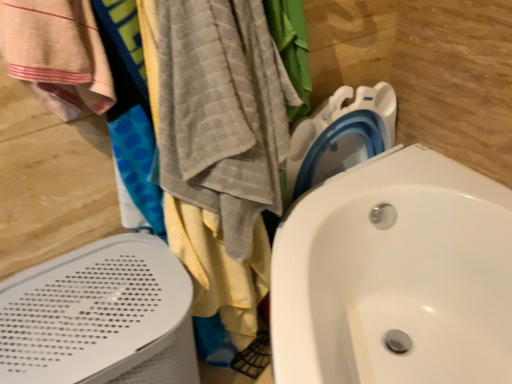
Question: Is white glossy sink at center facing towards gray textured towel at left, acting as the 2th beach towel starting from the left?

Choices:
 (A) no
 (B) yes

Answer: (A)

Question: From a real-world perspective, is white glossy sink at center positioned under gray textured towel at left, acting as the 2th beach towel starting from the left, based on gravity?

Choices:
 (A) no
 (B) yes

Answer: (B)

Question: Can you confirm if white glossy sink at center is thinner than gray textured towel at left, which is the first beach towel in right-to-left order?

Choices:
 (A) yes
 (B) no

Answer: (B)

Question: Is white glossy sink at center completely or partially outside of gray textured towel at left, acting as the 2th beach towel starting from the left?

Choices:
 (A) no
 (B) yes

Answer: (B)

Question: Can you confirm if white glossy sink at center is shorter than gray textured towel at left, which is the first beach towel in right-to-left order?

Choices:
 (A) no
 (B) yes

Answer: (B)

Question: Relative to gray textured towel at left, acting as the 2th beach towel starting from the left, is white glossy sink at center in front or behind?

Choices:
 (A) behind
 (B) front

Answer: (B)

Question: In terms of height, does white glossy sink at center look taller or shorter compared to gray textured towel at left, acting as the 2th beach towel starting from the left?

Choices:
 (A) tall
 (B) short

Answer: (B)

Question: Considering the positions of white glossy sink at center and gray textured towel at left, acting as the 2th beach towel starting from the left, in the image, is white glossy sink at center wider or thinner than gray textured towel at left, acting as the 2th beach towel starting from the left,?

Choices:
 (A) wide
 (B) thin

Answer: (A)

Question: Is white glossy sink at center inside or outside of gray textured towel at left, which is the first beach towel in right-to-left order?

Choices:
 (A) outside
 (B) inside

Answer: (A)

Question: From the image's perspective, is gray textured towel at left, acting as the 2th beach towel starting from the left, above or below white perforated bath heater at left?

Choices:
 (A) below
 (B) above

Answer: (B)

Question: Considering the positions of gray textured towel at left, acting as the 2th beach towel starting from the left, and white perforated bath heater at left in the image, is gray textured towel at left, acting as the 2th beach towel starting from the left, bigger or smaller than white perforated bath heater at left?

Choices:
 (A) big
 (B) small

Answer: (B)

Question: Is gray textured towel at left, acting as the 2th beach towel starting from the left, wider or thinner than white perforated bath heater at left?

Choices:
 (A) wide
 (B) thin

Answer: (B)

Question: Relative to white perforated bath heater at left, is gray textured towel at left, acting as the 2th beach towel starting from the left, in front or behind?

Choices:
 (A) behind
 (B) front

Answer: (B)

Question: Considering the positions of white perforated bath heater at left and white glossy sink at center in the image, is white perforated bath heater at left wider or thinner than white glossy sink at center?

Choices:
 (A) wide
 (B) thin

Answer: (B)

Question: From the image's perspective, is white perforated bath heater at left above or below white glossy sink at center?

Choices:
 (A) above
 (B) below

Answer: (B)